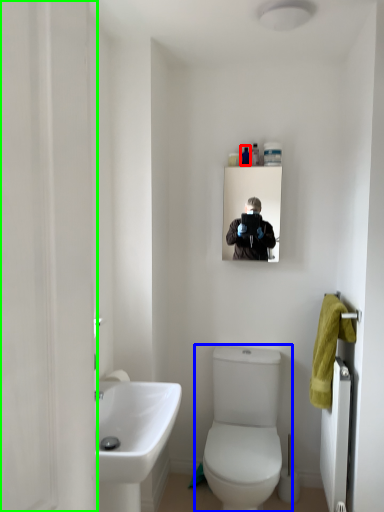
Question: Considering the real-world distances, which object is closest to toiletry (highlighted by a red box)? toilet (highlighted by a blue box) or screen door (highlighted by a green box).

Choices:
 (A) toilet
 (B) screen door

Answer: (A)